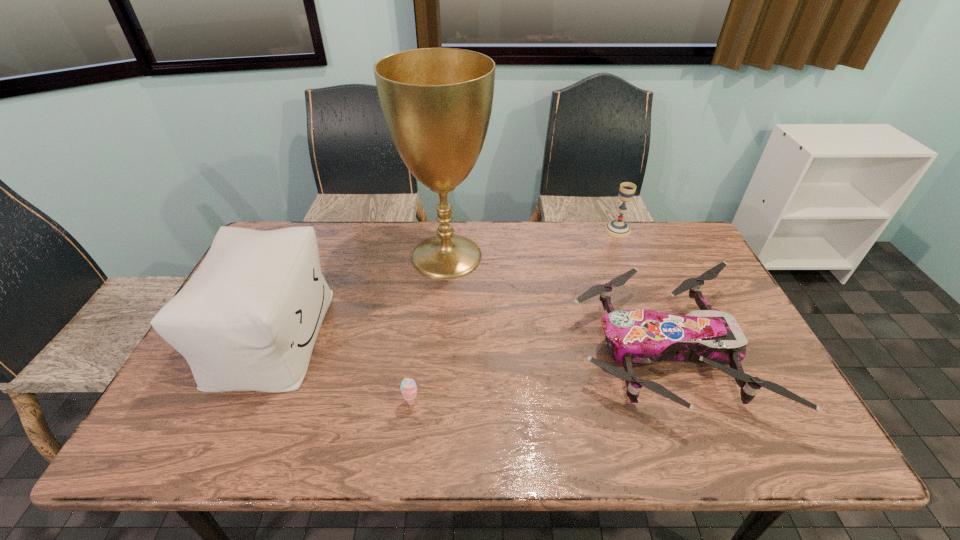
Locate an element on the screen. The image size is (960, 540). the smaller blue detergent is located at coordinates (505, 293).

Find the location of a particular element. This screenshot has height=540, width=960. brown radio receiver is located at coordinates (756, 312).

Find the location of `pottery`. pottery is located at coordinates (202, 365).

At what (x,y) coordinates should I click in order to perform the action: click on blue pottery. Please return your answer as a coordinate pair (x, y). The image size is (960, 540). Looking at the image, I should click on (202, 365).

What are the coordinates of `free spot located on the left of the tallest object` in the screenshot? It's located at (449, 214).

Where is `vacant region located on the front of the leftmost white detergent`? The image size is (960, 540). vacant region located on the front of the leftmost white detergent is located at coordinates (225, 390).

Find the location of a particular element. The width and height of the screenshot is (960, 540). vacant space located on the front of the rightmost white detergent is located at coordinates (708, 306).

Identify the location of free point located on the right of the farther blue detergent. point(475,234).

Identify the location of vacant region located on the back of the smallest white detergent. (604, 289).

At what (x,y) coordinates should I click in order to perform the action: click on vacant space located on the right of the fifth object from right to left. Please return your answer as a coordinate pair (x, y). Image resolution: width=960 pixels, height=540 pixels. Looking at the image, I should click on (593, 333).